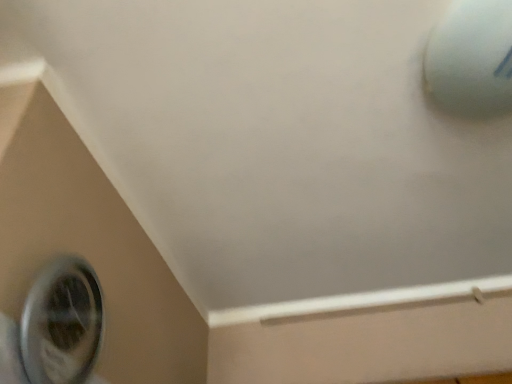
I want to click on metallic circular hole at lower left, so coord(62,323).

What do you see at coordinates (62, 323) in the screenshot? Image resolution: width=512 pixels, height=384 pixels. I see `metallic circular hole at lower left` at bounding box center [62, 323].

Where is `metallic circular hole at lower left`? This screenshot has width=512, height=384. metallic circular hole at lower left is located at coordinates (62, 323).